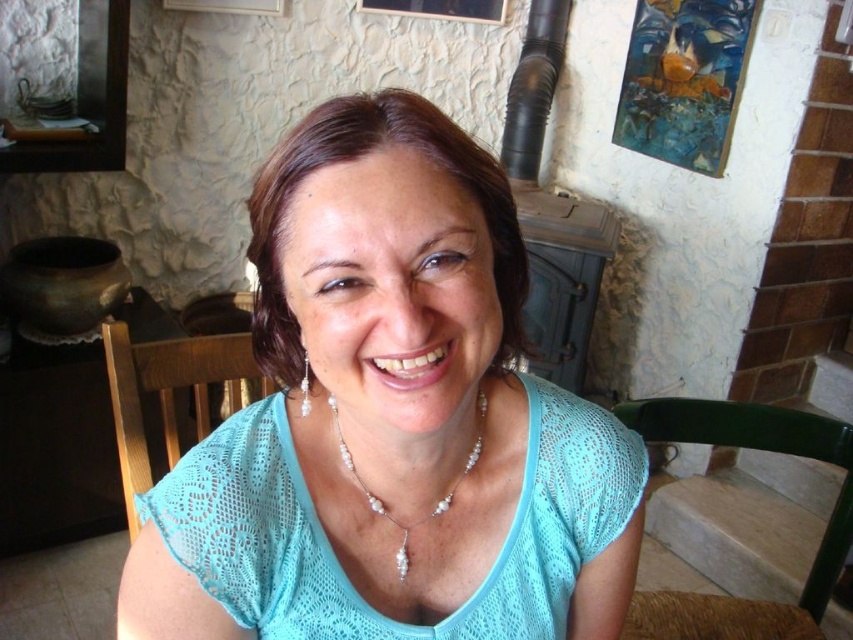
Question: Which object is the closest to the wooden chair at center?

Choices:
 (A) light blue lace shirt at center
 (B) pearl/pearlized necklace at center
 (C) brown wooden table at left

Answer: (A)

Question: Based on their relative distances, which object is nearer to the pearl/pearlized necklace at center?

Choices:
 (A) light blue lace shirt at center
 (B) green plastic chair at lower right
 (C) wooden chair at center

Answer: (A)

Question: Is wooden chair at center below pearl/pearlized necklace at center?

Choices:
 (A) yes
 (B) no

Answer: (A)

Question: Does light blue lace shirt at center appear over wooden chair at center?

Choices:
 (A) no
 (B) yes

Answer: (B)

Question: Which object is farther from the camera taking this photo?

Choices:
 (A) light blue lace shirt at center
 (B) green plastic chair at lower right

Answer: (B)

Question: Does wooden chair at center come in front of green plastic chair at lower right?

Choices:
 (A) yes
 (B) no

Answer: (A)